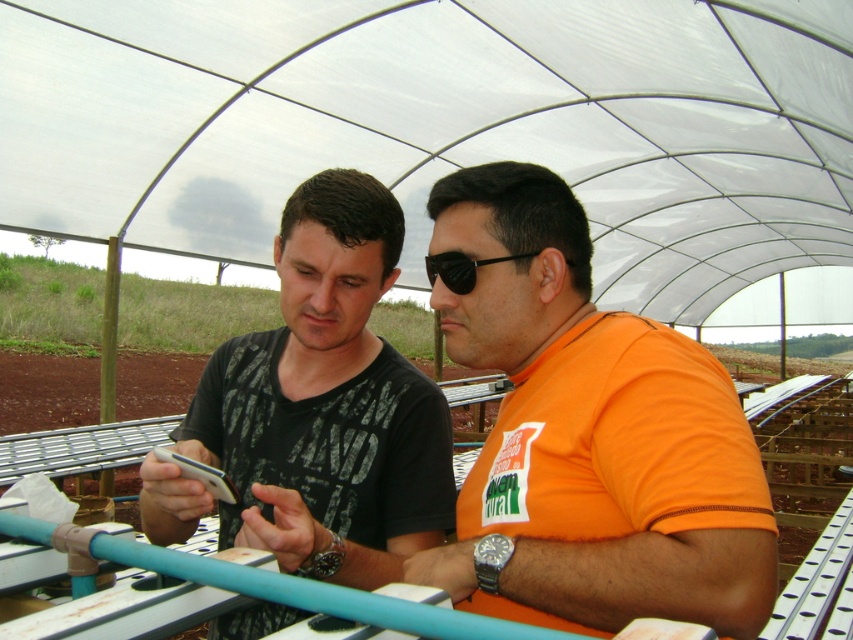
You are designing a layout for a small display case that can only fit items up to 30 cm wide. You have two items to place inside the case, the black matte shirt at center and the black plastic goggles at center. Which item will definitely fit in the display case?

The black plastic goggles at center will definitely fit in the display case since its width is smaller than the 30 cm limit, while the black matte shirt at center may be too wide depending on its exact measurement.